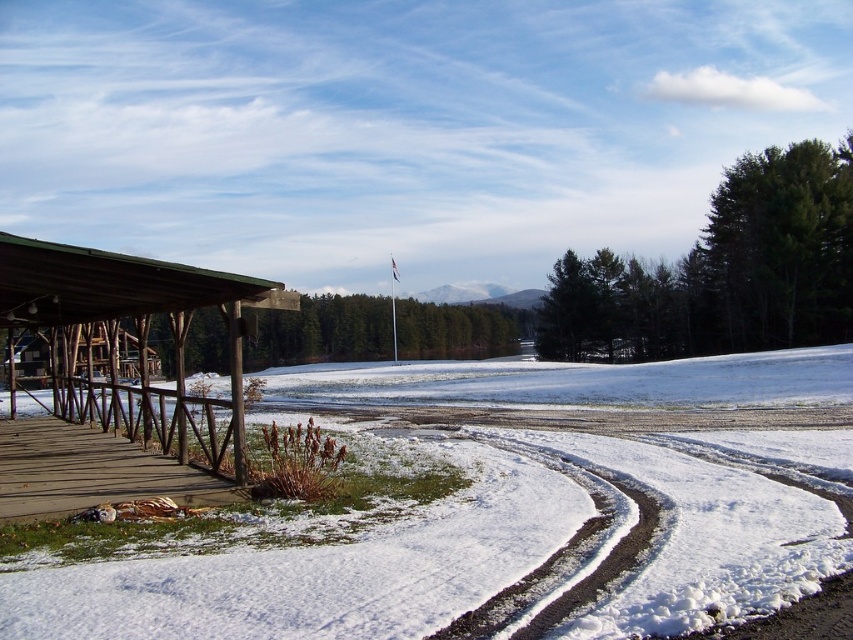
Is point (780, 376) less distant than point (64, 490)?

No, (780, 376) is further to viewer.

Is point (822, 396) closer to camera compared to point (231, 284)?

No, (822, 396) is further to viewer.

At what (x,y) coordinates should I click in order to perform the action: click on white powdery snow at lower left. Please return your answer as a coordinate pair (x, y). The height and width of the screenshot is (640, 853). Looking at the image, I should click on (477, 545).

Does brown wooden hut at left have a greater width compared to wooden planks at lower left?

Yes.

Which is above, brown wooden hut at left or wooden planks at lower left?

Positioned higher is brown wooden hut at left.

Between point (223, 298) and point (119, 476), which one is positioned behind?

The point (119, 476) is behind.

The height and width of the screenshot is (640, 853). What are the coordinates of `brown wooden hut at left` in the screenshot? It's located at (132, 308).

Is white powdery snow at lower left above wooden planks at lower left?

No.

Which is in front, point (459, 522) or point (82, 458)?

Point (459, 522) is in front.

This screenshot has height=640, width=853. I want to click on white powdery snow at lower left, so click(477, 545).